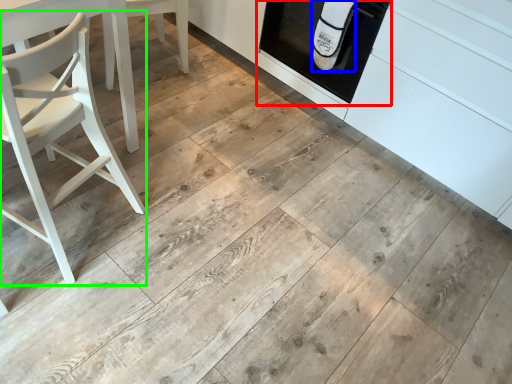
Question: Considering the real-world distances, which object is closest to oven (highlighted by a red box)? material (highlighted by a blue box) or chair (highlighted by a green box).

Choices:
 (A) material
 (B) chair

Answer: (A)